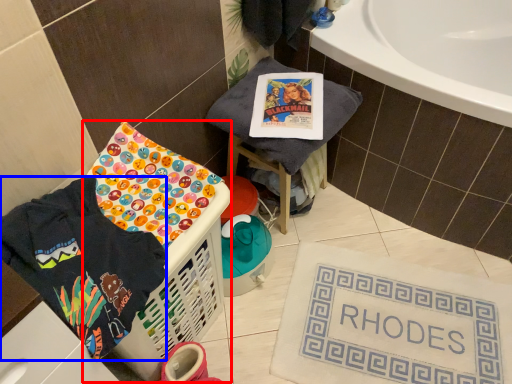
Question: Which point is closer to the camera, basket container (highlighted by a red box) or clothing (highlighted by a blue box)?

Choices:
 (A) basket container
 (B) clothing

Answer: (B)